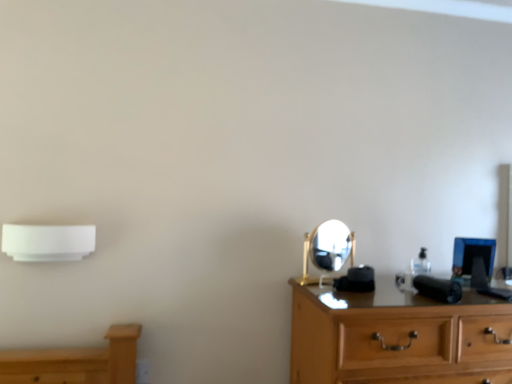
The image size is (512, 384). What are the coordinates of `wooden chest of drawers at right` in the screenshot? It's located at (397, 337).

Locate an element on the screen. The width and height of the screenshot is (512, 384). white plastic air conditioner at left is located at coordinates (48, 242).

Which object is closer to the camera taking this photo, white plastic electric outlet at lower left or white plastic air conditioner at left?

white plastic air conditioner at left is more forward.

Could you measure the distance between white plastic electric outlet at lower left and white plastic air conditioner at left?

white plastic electric outlet at lower left and white plastic air conditioner at left are 21.89 inches apart from each other.

In the scene shown: Based on their sizes in the image, would you say white plastic electric outlet at lower left is bigger or smaller than white plastic air conditioner at left?

In the image, white plastic electric outlet at lower left appears to be smaller than white plastic air conditioner at left.

Is white plastic electric outlet at lower left far away from white plastic air conditioner at left?

white plastic electric outlet at lower left is actually quite close to white plastic air conditioner at left.

Is wooden chest of drawers at right in front of gold metallic mirror at center?

Yes, it is in front of gold metallic mirror at center.

What's the angular difference between wooden chest of drawers at right and gold metallic mirror at center's facing directions?

The facing directions of wooden chest of drawers at right and gold metallic mirror at center are 17.6 degrees apart.

Would you say wooden chest of drawers at right contains gold metallic mirror at center?

No.

From a real-world perspective, between wooden chest of drawers at right and gold metallic mirror at center, who is vertically lower?

In real-world perspective, wooden chest of drawers at right is lower.

Which is farther, (332, 259) or (138, 373)?

The point (138, 373) is farther.

Considering the positions of objects gold metallic mirror at center and white plastic electric outlet at lower left in the image provided, who is more to the left, gold metallic mirror at center or white plastic electric outlet at lower left?

From the viewer's perspective, white plastic electric outlet at lower left appears more on the left side.

From the image's perspective, would you say gold metallic mirror at center is shown under white plastic electric outlet at lower left?

Actually, gold metallic mirror at center appears above white plastic electric outlet at lower left in the image.

You are a GUI agent. You are given a task and a screenshot of the screen. Output one action in this format:
    pyautogui.click(x=<x>, y=<y>)
    Task: Click on the electric outlet lying behind the gold metallic mirror at center
    
    Given the screenshot: What is the action you would take?
    pyautogui.click(x=142, y=371)

From the image's perspective, which one is positioned lower, white plastic air conditioner at left or gold metallic mirror at center?

gold metallic mirror at center is shown below in the image.

Which is in front, point (63, 233) or point (320, 235)?

The point (63, 233) is in front.

Is gold metallic mirror at center at the back of white plastic air conditioner at left?

No, gold metallic mirror at center is not at the back of white plastic air conditioner at left.

Between white plastic air conditioner at left and gold metallic mirror at center, which one has more height?

With more height is gold metallic mirror at center.

From the picture: Which is less distant, (353, 295) or (22, 246)?

Point (353, 295).

Is wooden chest of drawers at right thinner than white plastic air conditioner at left?

No, wooden chest of drawers at right is not thinner than white plastic air conditioner at left.

Does wooden chest of drawers at right have a smaller size compared to white plastic air conditioner at left?

No.

Find the location of a particular element. The width and height of the screenshot is (512, 384). mirror below the white plastic air conditioner at left (from the image's perspective) is located at coordinates (327, 248).

In terms of width, does gold metallic mirror at center look wider or thinner when compared to white plastic air conditioner at left?

In the image, gold metallic mirror at center appears to be more narrow than white plastic air conditioner at left.

Considering the positions of points (303, 280) and (68, 258), is point (303, 280) farther from camera compared to point (68, 258)?

Yes.

From the picture: Does gold metallic mirror at center touch white plastic air conditioner at left?

No, gold metallic mirror at center is not next to white plastic air conditioner at left.

Considering the relative sizes of gold metallic mirror at center and wooden chest of drawers at right in the image provided, is gold metallic mirror at center bigger than wooden chest of drawers at right?

No, gold metallic mirror at center is not bigger than wooden chest of drawers at right.

Is point (316, 241) more distant than point (362, 348)?

Yes, it is.

From a real-world perspective, is gold metallic mirror at center positioned above or below wooden chest of drawers at right?

gold metallic mirror at center is situated higher than wooden chest of drawers at right in the real world.

Are gold metallic mirror at center and wooden chest of drawers at right making contact?

No, gold metallic mirror at center is not making contact with wooden chest of drawers at right.

The width and height of the screenshot is (512, 384). I want to click on lamp that is on the left side of white plastic electric outlet at lower left, so (48, 242).

Find the location of `the chest of drawers that is in front of the gold metallic mirror at center`. the chest of drawers that is in front of the gold metallic mirror at center is located at coordinates (397, 337).

Based on their spatial positions, is wooden chest of drawers at right or gold metallic mirror at center further from white plastic air conditioner at left?

Based on the image, wooden chest of drawers at right appears to be further to white plastic air conditioner at left.

Considering their positions, is wooden chest of drawers at right positioned closer to gold metallic mirror at center than white plastic air conditioner at left?

The object closer to gold metallic mirror at center is wooden chest of drawers at right.

When comparing their distances from white plastic electric outlet at lower left, does gold metallic mirror at center or wooden chest of drawers at right seem further?

wooden chest of drawers at right is further to white plastic electric outlet at lower left.

Consider the image. When comparing their distances from white plastic electric outlet at lower left, does white plastic air conditioner at left or gold metallic mirror at center seem closer?

white plastic air conditioner at left is positioned closer to the anchor white plastic electric outlet at lower left.

Based on their spatial positions, is white plastic air conditioner at left or gold metallic mirror at center further from wooden chest of drawers at right?

white plastic air conditioner at left lies further to wooden chest of drawers at right than the other object.

Which object lies further to the anchor point white plastic electric outlet at lower left, wooden chest of drawers at right or white plastic air conditioner at left?

Based on the image, wooden chest of drawers at right appears to be further to white plastic electric outlet at lower left.

Consider the image. Considering their positions, is gold metallic mirror at center positioned further to white plastic air conditioner at left than wooden chest of drawers at right?

wooden chest of drawers at right lies further to white plastic air conditioner at left than the other object.

Looking at the image, which one is located further to gold metallic mirror at center, white plastic air conditioner at left or wooden chest of drawers at right?

white plastic air conditioner at left is positioned further to the anchor gold metallic mirror at center.

This screenshot has width=512, height=384. Identify the location of electric outlet located between white plastic air conditioner at left and wooden chest of drawers at right in the left-right direction. (142, 371).

Locate an element on the screen. The height and width of the screenshot is (384, 512). mirror located between white plastic air conditioner at left and wooden chest of drawers at right in the left-right direction is located at coordinates (327, 248).

Where is `electric outlet between white plastic air conditioner at left and gold metallic mirror at center`? Image resolution: width=512 pixels, height=384 pixels. electric outlet between white plastic air conditioner at left and gold metallic mirror at center is located at coordinates click(142, 371).

This screenshot has width=512, height=384. I want to click on mirror located between white plastic electric outlet at lower left and wooden chest of drawers at right in the left-right direction, so click(x=327, y=248).